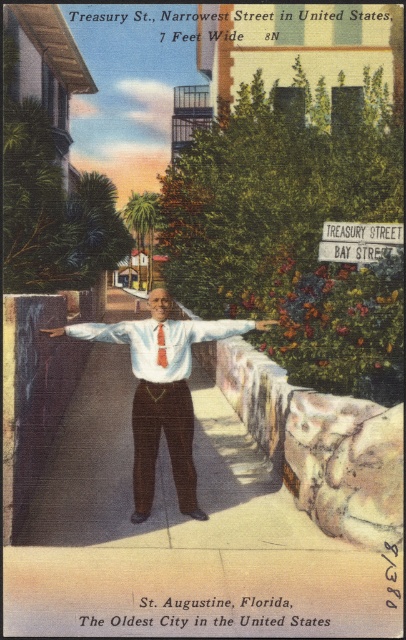
Question: Which object appears closest to the camera in this image?

Choices:
 (A) white shirt at center
 (B) white matte hand at center
 (C) smooth leather hand at center

Answer: (A)

Question: Is the position of white satin shirt at center more distant than that of white satin dress shirt at center?

Choices:
 (A) no
 (B) yes

Answer: (A)

Question: Which object appears closest to the camera in this image?

Choices:
 (A) white cotton shirt at center
 (B) white matte hand at center
 (C) red silk tie at center

Answer: (C)

Question: Considering the relative positions of white matte hand at center and smooth leather hand at center in the image provided, where is white matte hand at center located with respect to smooth leather hand at center?

Choices:
 (A) above
 (B) below

Answer: (A)

Question: From the image, what is the correct spatial relationship of white shirt at center in relation to smooth leather hand at center?

Choices:
 (A) above
 (B) below

Answer: (B)

Question: Which point appears closest to the camera in this image?

Choices:
 (A) (181, 323)
 (B) (276, 321)
 (C) (159, 342)

Answer: (C)